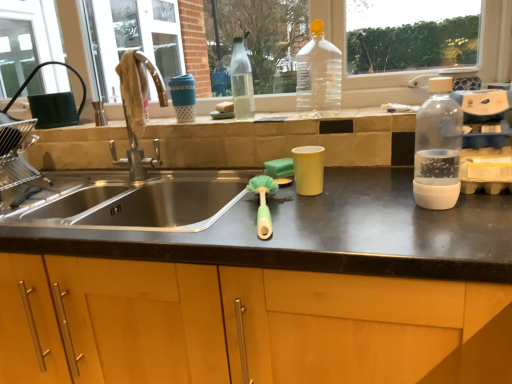
Identify the location of vacant space to the right of transparent plastic bottle at center, the 1th bottle positioned from the left. The width and height of the screenshot is (512, 384). (282, 116).